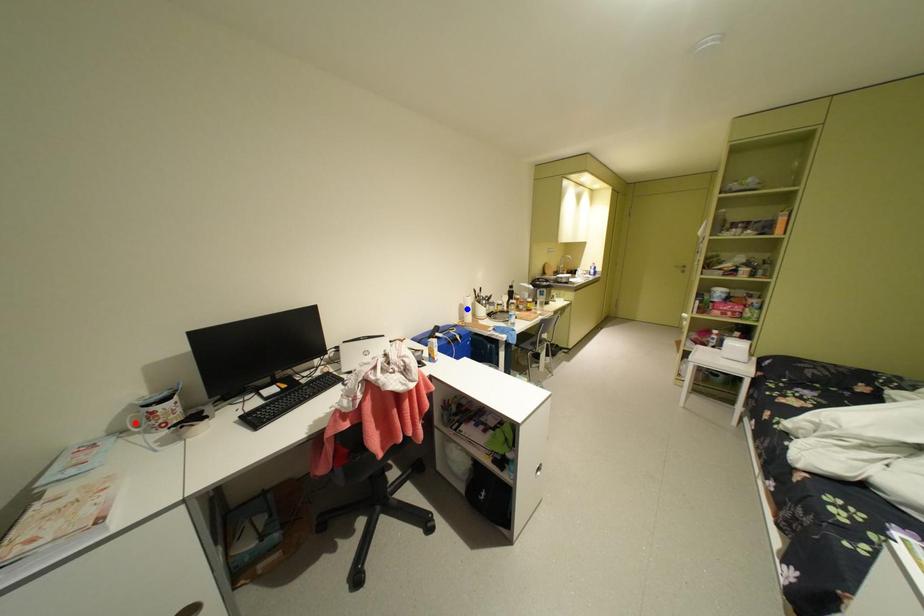
Question: Which of the two points in the image is closer to the camera?

Choices:
 (A) Blue point is closer.
 (B) Red point is closer.

Answer: (B)